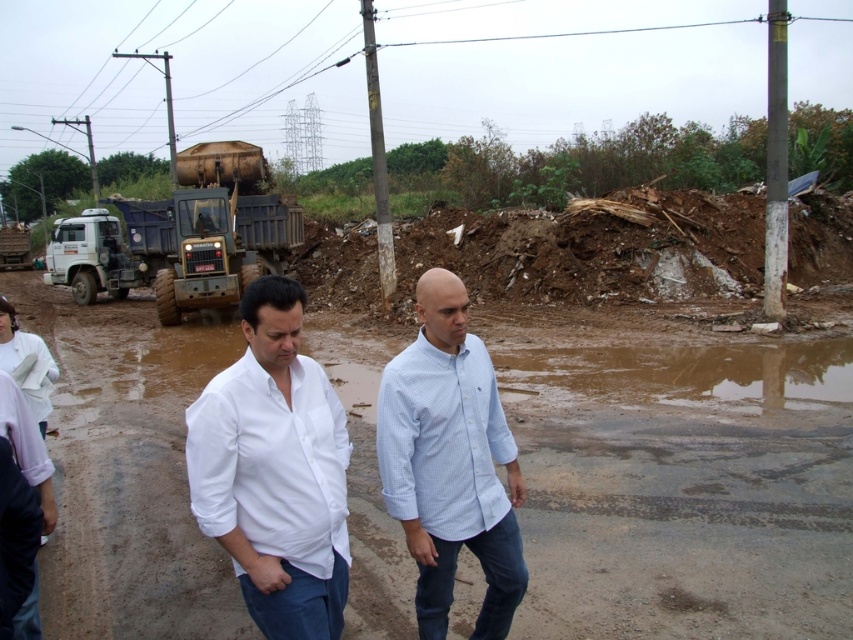
Question: Is white cotton shirt at center bigger than light blue checkered shirt at center?

Choices:
 (A) no
 (B) yes

Answer: (A)

Question: Is white cotton shirt at center wider than light blue checkered shirt at center?

Choices:
 (A) no
 (B) yes

Answer: (A)

Question: Is white cotton shirt at center above light blue checkered shirt at center?

Choices:
 (A) no
 (B) yes

Answer: (B)

Question: Which point is farther from the camera taking this photo?

Choices:
 (A) (210, 500)
 (B) (480, 536)

Answer: (B)